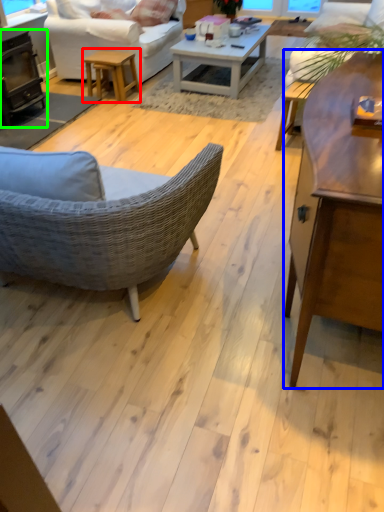
Question: Considering the real-world distances, which object is closest to table (highlighted by a red box)? coffee table (highlighted by a blue box) or fireplace (highlighted by a green box).

Choices:
 (A) coffee table
 (B) fireplace

Answer: (B)